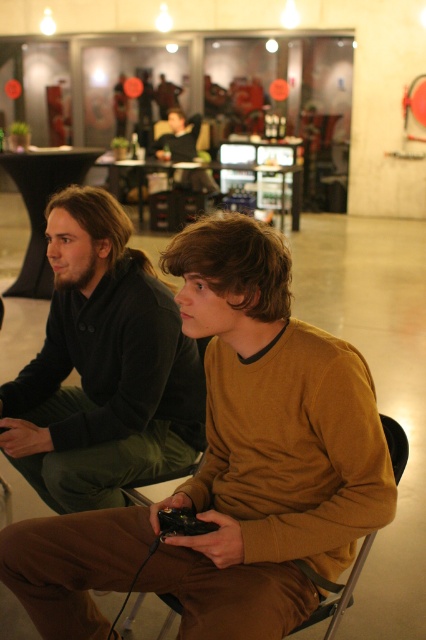
Question: Which point is closer to the camera?

Choices:
 (A) (132, 492)
 (B) (239, 362)

Answer: (B)

Question: Observing the image, what is the correct spatial positioning of brown matte sweater at center in reference to metallic silver chair at center?

Choices:
 (A) below
 (B) above

Answer: (B)

Question: Is brown cotton shirt at center positioned behind brown matte sweater at center?

Choices:
 (A) no
 (B) yes

Answer: (A)

Question: Does brown cotton shirt at center have a greater width compared to metallic silver chair at center?

Choices:
 (A) yes
 (B) no

Answer: (A)

Question: Considering the real-world distances, which object is closest to the brown matte sweater at center?

Choices:
 (A) metallic silver chair at center
 (B) brown cotton shirt at center

Answer: (B)

Question: Which point is farther to the camera?

Choices:
 (A) brown cotton shirt at center
 (B) brown matte sweater at center
 (C) metallic silver chair at center

Answer: (B)